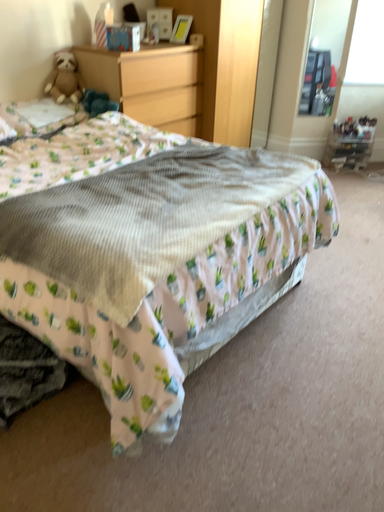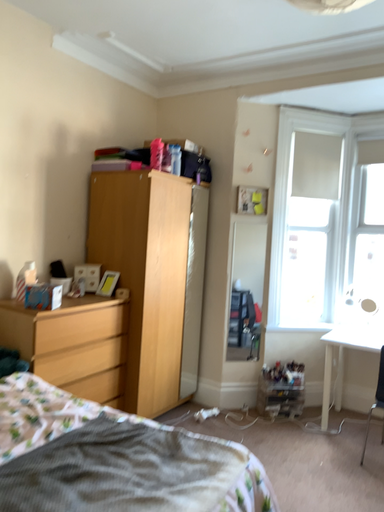
Question: How did the camera likely rotate when shooting the video?

Choices:
 (A) rotated downward
 (B) rotated upward

Answer: (B)